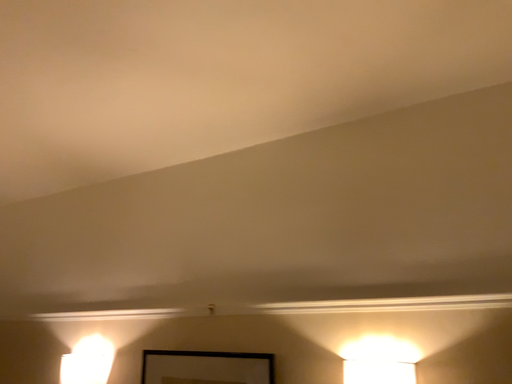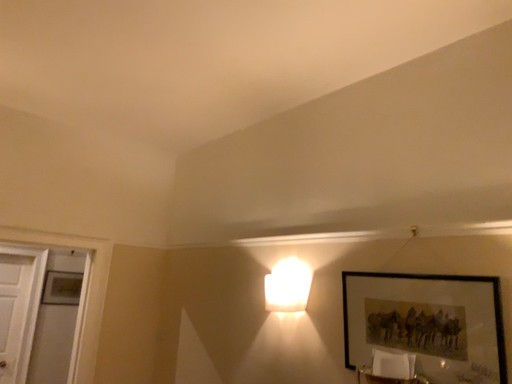
Question: Which way did the camera rotate in the video?

Choices:
 (A) rotated downward
 (B) rotated upward

Answer: (A)